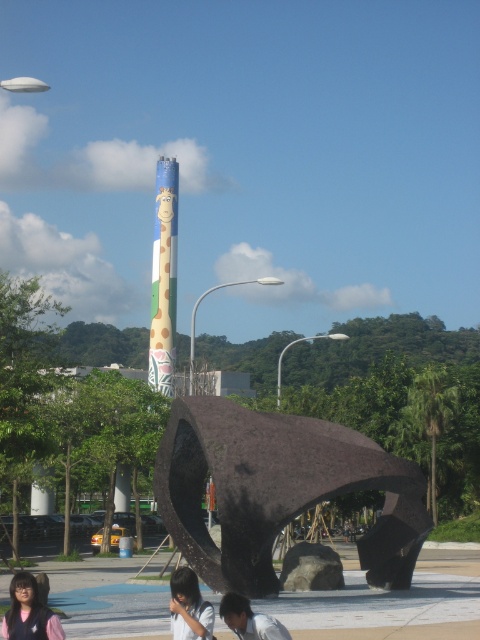
Between multicolored painted totem pole at center and dark brown hair at lower center, which one is positioned higher?

multicolored painted totem pole at center

At what (x,y) coordinates should I click in order to perform the action: click on multicolored painted totem pole at center. Please return your answer as a coordinate pair (x, y). This screenshot has width=480, height=640. Looking at the image, I should click on (164, 276).

Between point (168, 205) and point (206, 616), which one is positioned in front?

Point (206, 616) is in front.

At what (x,y) coordinates should I click in order to perform the action: click on multicolored painted totem pole at center. Please return your answer as a coordinate pair (x, y). Image resolution: width=480 pixels, height=640 pixels. Looking at the image, I should click on (164, 276).

Locate an element on the screen. This screenshot has height=640, width=480. matte black hair at lower left is located at coordinates (28, 612).

Which is in front, point (14, 596) or point (229, 618)?

Point (229, 618) is in front.

Between point (4, 618) and point (255, 630), which one is positioned behind?

The point (4, 618) is behind.

Identify the location of matte black hair at lower left. (28, 612).

Is dark brown stone sculpture at center closer to the viewer compared to multicolored painted totem pole at center?

Yes.

Does dark brown stone sculpture at center appear under multicolored painted totem pole at center?

Correct, dark brown stone sculpture at center is located below multicolored painted totem pole at center.

Is point (365, 577) positioned before point (165, 307)?

Yes, point (365, 577) is closer to viewer.

Where is `dark brown stone sculpture at center`? dark brown stone sculpture at center is located at coordinates (277, 490).